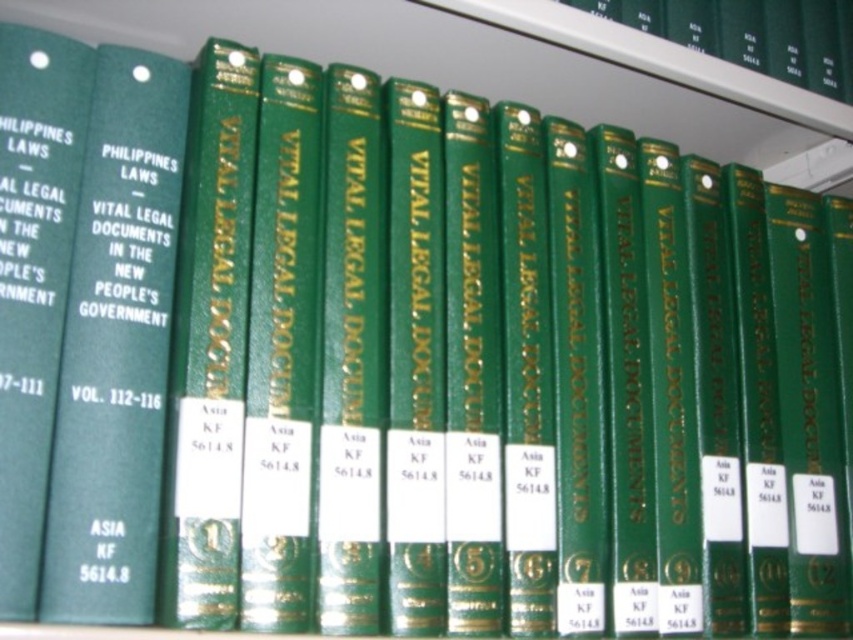
The height and width of the screenshot is (640, 853). Describe the element at coordinates (115, 346) in the screenshot. I see `green hardcover book at center` at that location.

Is green hardcover book at center bigger than green hardcover book at left?

Yes, green hardcover book at center is bigger than green hardcover book at left.

The width and height of the screenshot is (853, 640). What are the coordinates of `green hardcover book at center` in the screenshot? It's located at (115, 346).